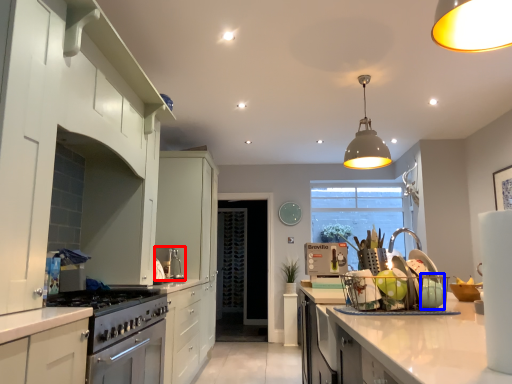
Question: Which of the following is the farthest to the observer, appliance (highlighted by a red box) or appliance (highlighted by a blue box)?

Choices:
 (A) appliance
 (B) appliance

Answer: (A)